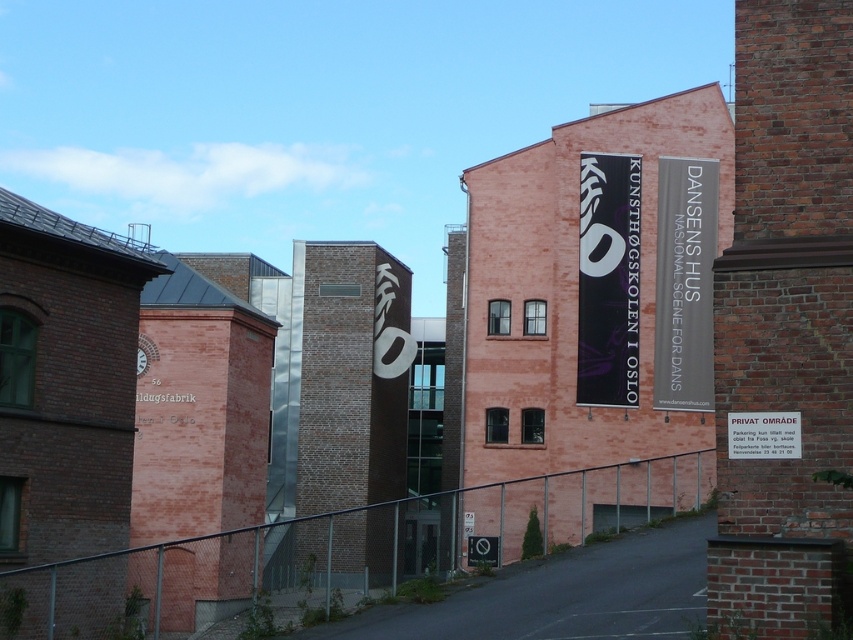
Question: Does black matte banner at center appear on the left side of white fabric banner at center-right?

Choices:
 (A) yes
 (B) no

Answer: (A)

Question: Can you confirm if white fabric banner at center-right is positioned to the left of white paper sign at center right?

Choices:
 (A) yes
 (B) no

Answer: (B)

Question: Considering the real-world distances, which object is closest to the black matte banner at center?

Choices:
 (A) white plastic sign at lower center
 (B) white fabric banner at center-right

Answer: (B)

Question: Is white fabric banner at center-right positioned in front of white paper sign at center right?

Choices:
 (A) no
 (B) yes

Answer: (A)

Question: Which of these objects is positioned closest to the black matte banner at center?

Choices:
 (A) white fabric banner at center-right
 (B) white plastic sign at lower center

Answer: (A)

Question: Which of the following is the closest to the observer?

Choices:
 (A) (669, 365)
 (B) (734, 433)
 (C) (467, 547)
 (D) (610, 333)

Answer: (B)